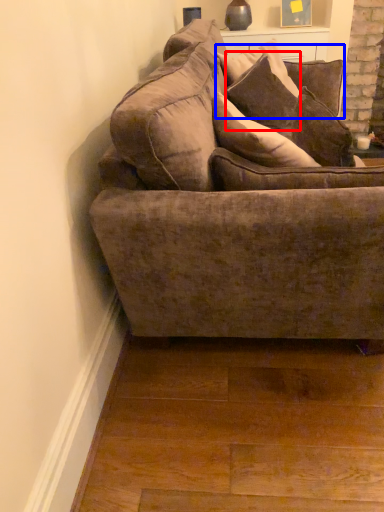
Question: Among these objects, which one is nearest to the camera, pillow (highlighted by a red box) or pillow (highlighted by a blue box)?

Choices:
 (A) pillow
 (B) pillow

Answer: (A)